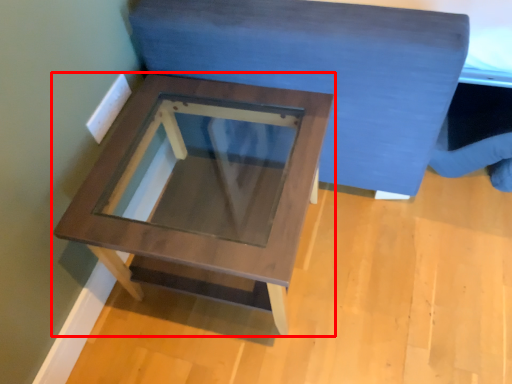
Question: From the image's perspective, what is the correct spatial positioning of table (annotated by the red box) in reference to bedding?

Choices:
 (A) below
 (B) above

Answer: (A)